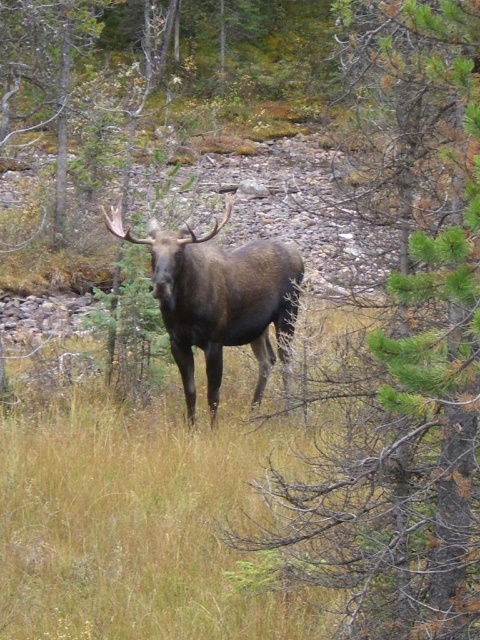
How far apart are green leafy tree at center and brown furry moose at center?

The distance of green leafy tree at center from brown furry moose at center is 2.68 meters.

Which is in front, point (315, 563) or point (277, 244)?

Point (315, 563) is more forward.

What are the coordinates of `green leafy tree at center` in the screenshot? It's located at (407, 356).